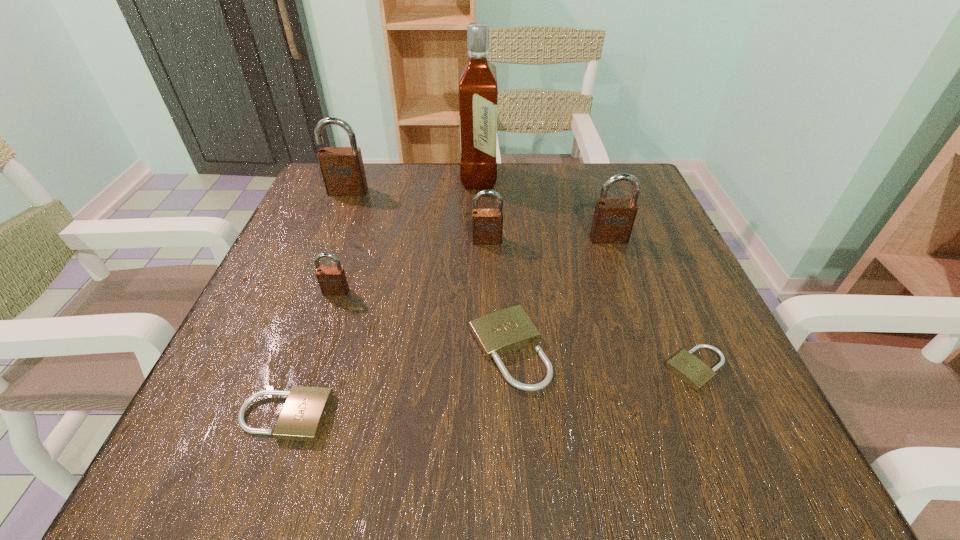
Locate an element on the screen. This screenshot has height=540, width=960. beige padlock identified as the second closest to the second beige padlock from right to left is located at coordinates point(302,417).

Where is `beige padlock that stands as the closest to the rightmost beige padlock`? The height and width of the screenshot is (540, 960). beige padlock that stands as the closest to the rightmost beige padlock is located at coordinates (499, 333).

What are the coordinates of `free location that satisfies the following two spatial constraints: 1. on the front label of the liquor; 2. on the front-facing side of the fourth shortest object` in the screenshot? It's located at (478, 292).

Find the location of a particular element. This screenshot has width=960, height=540. vacant space that satisfies the following two spatial constraints: 1. on the front label of the tallest object; 2. on the front-facing side of the farthest padlock is located at coordinates (478, 192).

Image resolution: width=960 pixels, height=540 pixels. I want to click on free space that satisfies the following two spatial constraints: 1. on the front-facing side of the second beige padlock from right to left; 2. on the left side of the tallest padlock, so click(x=284, y=350).

Identify the location of free space that satisfies the following two spatial constraints: 1. on the front-facing side of the third shortest padlock; 2. on the right side of the fifth shortest object. This screenshot has height=540, width=960. (490, 350).

Find the location of a particular element. This screenshot has height=540, width=960. blank area in the image that satisfies the following two spatial constraints: 1. on the front label of the biggest beige padlock; 2. on the left side of the liquor is located at coordinates (478, 350).